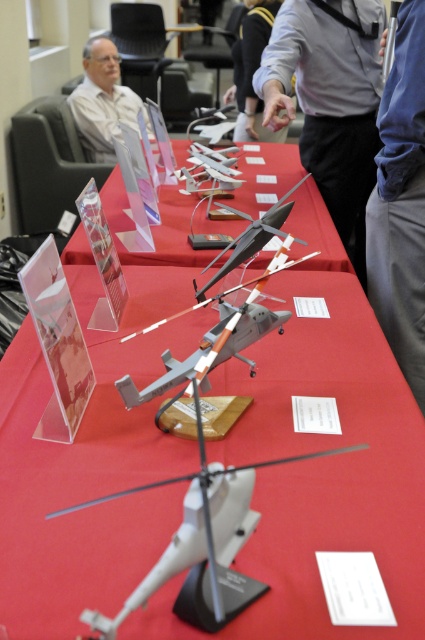
Can you confirm if red matte tablecloth at center is smaller than gray fabric shirt at upper center?

No.

From the picture: Which of these two, red matte tablecloth at center or gray fabric shirt at upper center, stands taller?

With more height is gray fabric shirt at upper center.

Does point (309, 326) come farther from viewer compared to point (340, 99)?

No, (309, 326) is in front of (340, 99).

Image resolution: width=425 pixels, height=640 pixels. Find the location of `red matte tablecloth at center`. red matte tablecloth at center is located at coordinates (320, 472).

Between red matte tablecloth at center and matte plastic model airplane at center, which one is positioned higher?

Positioned higher is matte plastic model airplane at center.

Image resolution: width=425 pixels, height=640 pixels. Find the location of `red matte tablecloth at center`. red matte tablecloth at center is located at coordinates (320, 472).

Locate an element on the screen. red matte tablecloth at center is located at coordinates (320, 472).

Consider the image. Between gray fabric shirt at upper center and blue fabric shirt at upper center, which one is positioned lower?

gray fabric shirt at upper center is lower down.

Who is more distant from viewer, (325, 164) or (249, 20)?

Positioned behind is point (249, 20).

Locate an element on the screen. Image resolution: width=425 pixels, height=640 pixels. gray fabric shirt at upper center is located at coordinates (329, 97).

The width and height of the screenshot is (425, 640). What are the coordinates of `gray fabric shirt at upper center` in the screenshot? It's located at (329, 97).